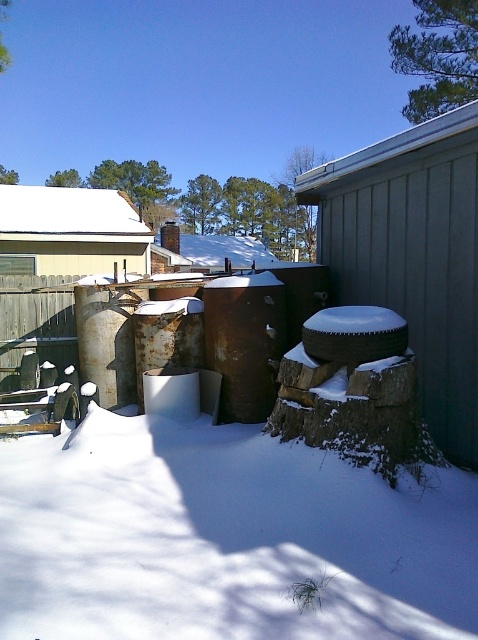
You are standing in the snowy backyard and want to place a 2.5 feet tall snowman exactly where the white powdery snow at lower center is located. Given the distance between you and the snow, will you be able to build the snowman there without moving closer?

The distance between you and the white powdery snow at lower center is 7.07 feet. Since the snowman is only 2.5 feet tall, the distance does not affect the ability to build it there. You can build the snowman at the white powdery snow at lower center without moving closer as the height requirement is met.